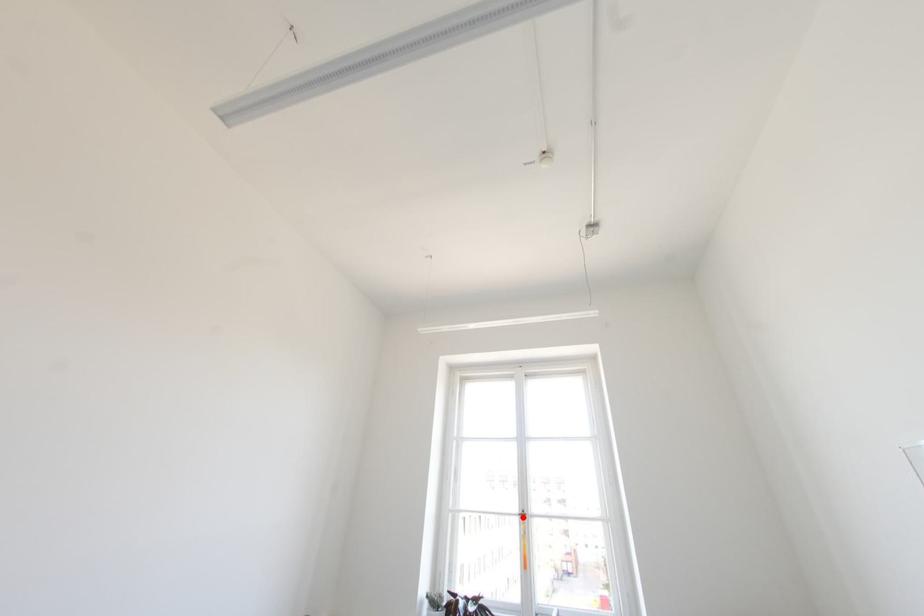
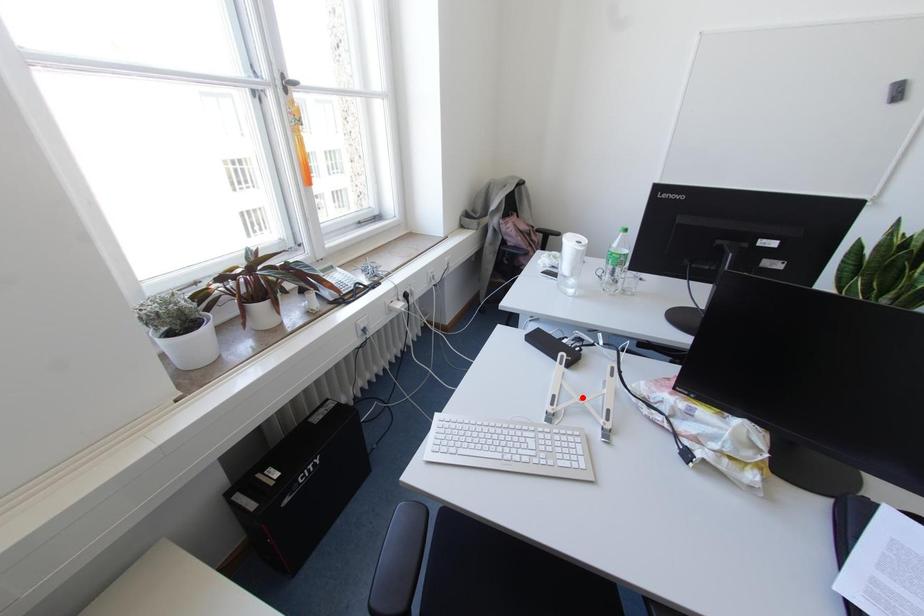
I am providing you with two images of the same scene from different viewpoints. A red point is marked on the first image and another point is marked on the second image. Does the point marked in image1 correspond to the same location as the one in image2?

No